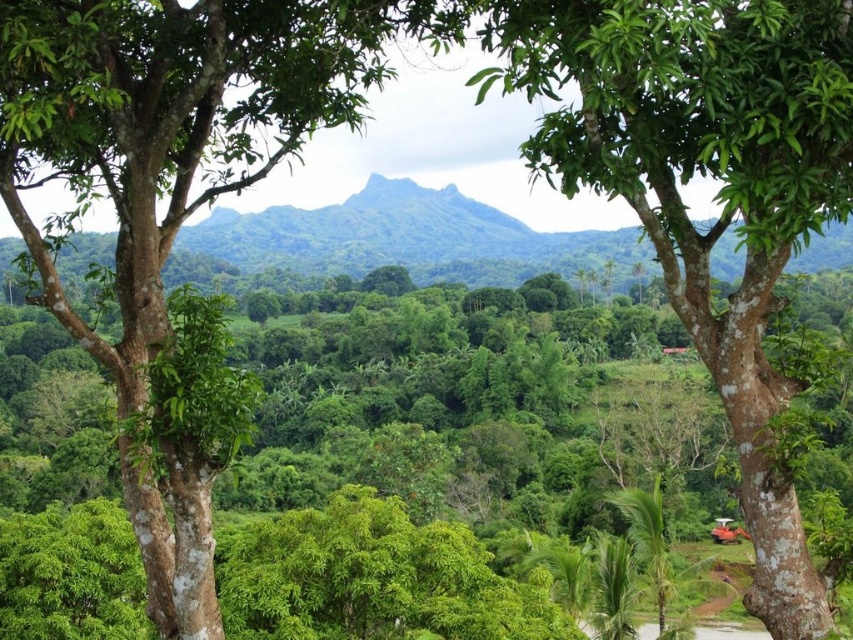
Is point (120, 192) more distant than point (776, 397)?

Yes, it is.

Is point (210, 182) closer to camera compared to point (712, 44)?

No, it is behind (712, 44).

What are the coordinates of `smooth brown tree trunk at left` in the screenshot? It's located at (175, 198).